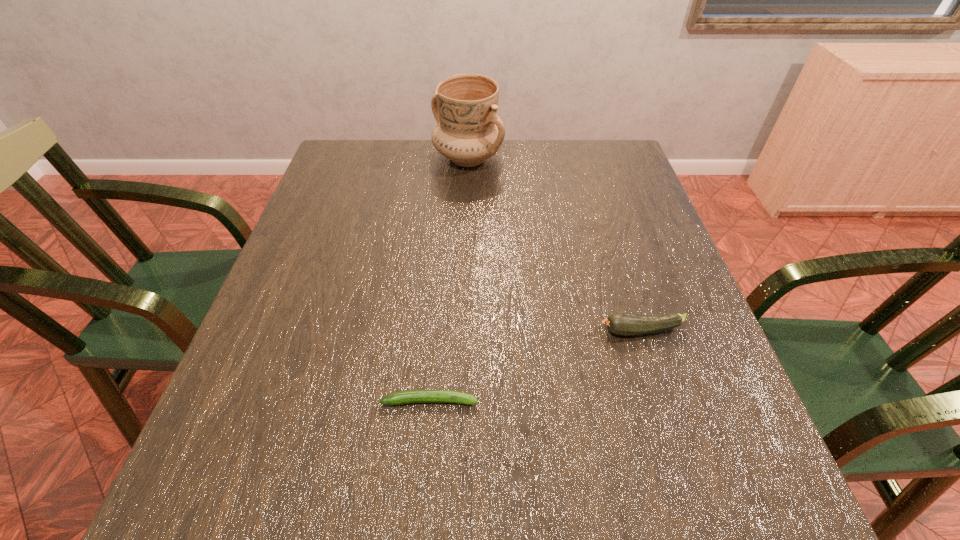
Locate an element on the screen. The image size is (960, 540). free space between the tallest object and the right zucchini is located at coordinates (554, 245).

Where is `empty space that is in between the tallest object and the second nearest object`? This screenshot has width=960, height=540. empty space that is in between the tallest object and the second nearest object is located at coordinates (554, 245).

Find the location of `unoccupied position between the left zucchini and the tallest object`. unoccupied position between the left zucchini and the tallest object is located at coordinates (448, 280).

The height and width of the screenshot is (540, 960). Find the location of `free space between the farthest object and the shortest object`. free space between the farthest object and the shortest object is located at coordinates (448, 280).

The image size is (960, 540). Identify the location of vacant space that's between the rightmost object and the left zucchini. (536, 366).

Where is `free space between the second shortest object and the shortest object`? Image resolution: width=960 pixels, height=540 pixels. free space between the second shortest object and the shortest object is located at coordinates (536, 366).

Where is `free space between the nearer zucchini and the second nearest object`? This screenshot has width=960, height=540. free space between the nearer zucchini and the second nearest object is located at coordinates (536, 366).

Where is `free area in between the farthest object and the nearest object`? This screenshot has width=960, height=540. free area in between the farthest object and the nearest object is located at coordinates (448, 280).

At what (x,y) coordinates should I click in order to perform the action: click on free space between the farther zucchini and the shorter zucchini. Please return your answer as a coordinate pair (x, y). The width and height of the screenshot is (960, 540). Looking at the image, I should click on (536, 366).

Select which object appears as the closest to the farthest object. Please provide its 2D coordinates. Your answer should be formatted as a tuple, i.e. [(x, y)], where the tuple contains the x and y coordinates of a point satisfying the conditions above.

[(625, 324)]